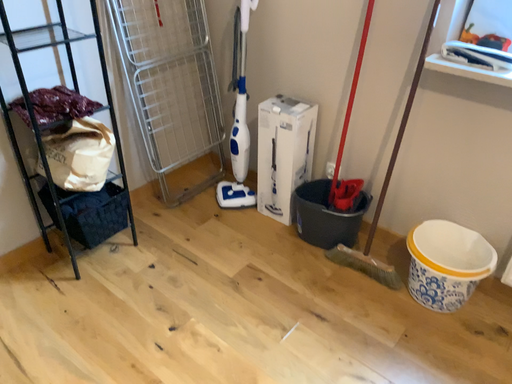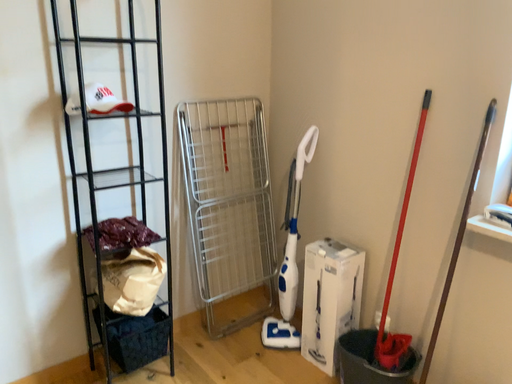
Question: Which way did the camera rotate in the video?

Choices:
 (A) rotated right
 (B) rotated left

Answer: (B)